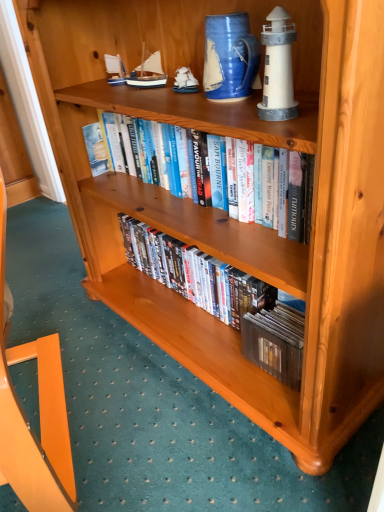
The image size is (384, 512). What do you see at coordinates (230, 57) in the screenshot?
I see `blue ceramic pitcher at upper center` at bounding box center [230, 57].

You are a GUI agent. You are given a task and a screenshot of the screen. Output one action in this format:
    pyautogui.click(x=<x>, y=<y>)
    Task: Click on the white matte lighthouse at upper right, acting as the third toy starting from the left
    
    Given the screenshot: What is the action you would take?
    pyautogui.click(x=278, y=68)

Considering the relative positions of wooden ship at upper center, acting as the 2th toy starting from the back, and blue ceramic pitcher at upper center in the image provided, is wooden ship at upper center, acting as the 2th toy starting from the back, to the left or to the right of blue ceramic pitcher at upper center?

Clearly, wooden ship at upper center, acting as the 2th toy starting from the back, is on the left of blue ceramic pitcher at upper center in the image.

Identify the location of pitcher that appears on the right of wooden ship at upper center, which is the 2th toy from right to left. (230, 57).

Based on the photo, is the depth of wooden ship at upper center, acting as the 2th toy starting from the front, greater than that of blue ceramic pitcher at upper center?

Yes, it is.

From the picture: Is wooden ship at upper center, which is the 2th toy from right to left, facing away from blue ceramic pitcher at upper center?

That's not correct — wooden ship at upper center, which is the 2th toy from right to left, is not looking away from blue ceramic pitcher at upper center.

Which point is more forward, [187,194] or [266,92]?

The point [266,92] is in front.

From the image's perspective, who appears lower, hardcover books at center, placed as the first book when sorted from top to bottom, or white matte lighthouse at upper right, the 1th toy in the right-to-left sequence?

From the image's view, hardcover books at center, placed as the first book when sorted from top to bottom, is below.

Is hardcover books at center, placed as the first book when sorted from top to bottom, with white matte lighthouse at upper right, the 1th toy in the right-to-left sequence?

hardcover books at center, placed as the first book when sorted from top to bottom, and white matte lighthouse at upper right, the 1th toy in the right-to-left sequence, are not in contact.

Considering the positions of point (208, 89) and point (131, 74), is point (208, 89) closer or farther from the camera than point (131, 74)?

Point (208, 89).

Is blue ceramic pitcher at upper center smaller than blue painted wood sailboat at upper center, acting as the 3th toy starting from the front?

Incorrect, blue ceramic pitcher at upper center is not smaller in size than blue painted wood sailboat at upper center, acting as the 3th toy starting from the front.

Is blue ceramic pitcher at upper center positioned with its back to blue painted wood sailboat at upper center, which ranks as the first toy in left-to-right order?

blue ceramic pitcher at upper center does not have its back to blue painted wood sailboat at upper center, which ranks as the first toy in left-to-right order.

In the scene shown: From the image's perspective, which object appears higher, white matte lighthouse at upper right, the 1th toy in the right-to-left sequence, or matte wooden dvds at center, the 1th book positioned from the bottom?

white matte lighthouse at upper right, the 1th toy in the right-to-left sequence, is shown above in the image.

Is white matte lighthouse at upper right, placed as the 3th toy when sorted from back to front, positioned beyond the bounds of matte wooden dvds at center, the 1th book positioned from the bottom?

white matte lighthouse at upper right, placed as the 3th toy when sorted from back to front, is positioned outside matte wooden dvds at center, the 1th book positioned from the bottom.

Starting from the white matte lighthouse at upper right, the 1th toy in the right-to-left sequence, which book is the 2nd one behind? Please provide its 2D coordinates.

[(223, 297)]

Considering the positions of objects white matte lighthouse at upper right, the 1th toy in the right-to-left sequence, and matte wooden dvds at center, which appears as the 2th book when viewed from the top, in the image provided, who is in front, white matte lighthouse at upper right, the 1th toy in the right-to-left sequence, or matte wooden dvds at center, which appears as the 2th book when viewed from the top,?

white matte lighthouse at upper right, the 1th toy in the right-to-left sequence, is more forward.

In the image, is hardcover books at center, placed as the first book when sorted from top to bottom, positioned in front of or behind matte wooden dvds at center, the 1th book positioned from the bottom?

Clearly, hardcover books at center, placed as the first book when sorted from top to bottom, is in front of matte wooden dvds at center, the 1th book positioned from the bottom.

In the scene shown: From a real-world perspective, is hardcover books at center, placed as the first book when sorted from top to bottom, located higher than matte wooden dvds at center, the 1th book positioned from the bottom?

Yes.

Based on the photo, is hardcover books at center, which is the 2th book from bottom to top, far away from matte wooden dvds at center, the 1th book positioned from the bottom?

hardcover books at center, which is the 2th book from bottom to top, is near matte wooden dvds at center, the 1th book positioned from the bottom, not far away.

Does blue ceramic pitcher at upper center come behind matte wooden dvds at center, the 1th book positioned from the bottom?

No, it is in front of matte wooden dvds at center, the 1th book positioned from the bottom.

Between point (226, 90) and point (129, 256), which one is positioned in front?

Positioned in front is point (226, 90).

Which object is positioned more to the right, blue ceramic pitcher at upper center or matte wooden dvds at center, the 1th book positioned from the bottom?

A: matte wooden dvds at center, the 1th book positioned from the bottom.

Is matte wooden dvds at center, which appears as the 2th book when viewed from the top, at the left side of blue painted wood sailboat at upper center, placed as the first toy when sorted from back to front?

In fact, matte wooden dvds at center, which appears as the 2th book when viewed from the top, is to the right of blue painted wood sailboat at upper center, placed as the first toy when sorted from back to front.

From their relative heights in the image, would you say matte wooden dvds at center, the 1th book positioned from the bottom, is taller or shorter than blue painted wood sailboat at upper center, which ranks as the third toy in right-to-left order?

Clearly, matte wooden dvds at center, the 1th book positioned from the bottom, is taller compared to blue painted wood sailboat at upper center, which ranks as the third toy in right-to-left order.

In the image, is matte wooden dvds at center, the 1th book positioned from the bottom, positioned in front of or behind blue painted wood sailboat at upper center, which ranks as the third toy in right-to-left order?

Clearly, matte wooden dvds at center, the 1th book positioned from the bottom, is in front of blue painted wood sailboat at upper center, which ranks as the third toy in right-to-left order.

From the image's perspective, starting from the blue painted wood sailboat at upper center, placed as the first toy when sorted from back to front, which book is the 2nd one below? Please provide its 2D coordinates.

[(223, 297)]

The height and width of the screenshot is (512, 384). There is a blue ceramic pitcher at upper center. What are the coordinates of `the 1st toy above it (from the image's perspective)` in the screenshot? It's located at (185, 81).

Image resolution: width=384 pixels, height=512 pixels. What are the coordinates of `the 2nd book to the left of the white matte lighthouse at upper right, the 1th toy in the right-to-left sequence, counting from the anchor's position` in the screenshot? It's located at (224, 177).

Which object lies nearer to the anchor point white matte lighthouse at upper right, which is counted as the first toy, starting from the front, blue ceramic pitcher at upper center or hardcover books at center, which is the 2th book from bottom to top?

blue ceramic pitcher at upper center lies closer to white matte lighthouse at upper right, which is counted as the first toy, starting from the front, than the other object.

Based on their spatial positions, is white matte lighthouse at upper right, placed as the 3th toy when sorted from back to front, or blue painted wood sailboat at upper center, acting as the 3th toy starting from the front, further from hardcover books at center, which is the 2th book from bottom to top?

white matte lighthouse at upper right, placed as the 3th toy when sorted from back to front, is further to hardcover books at center, which is the 2th book from bottom to top.

Considering their positions, is hardcover books at center, which is the 2th book from bottom to top, positioned closer to wooden ship at upper center, which is the 2th toy from right to left, than white matte lighthouse at upper right, which is counted as the first toy, starting from the front?

The object closer to wooden ship at upper center, which is the 2th toy from right to left, is hardcover books at center, which is the 2th book from bottom to top.

Based on their spatial positions, is white matte lighthouse at upper right, placed as the 3th toy when sorted from back to front, or blue ceramic pitcher at upper center closer to matte wooden dvds at center, the 1th book positioned from the bottom?

blue ceramic pitcher at upper center.

Estimate the real-world distances between objects in this image. Which object is further from matte wooden dvds at center, the 1th book positioned from the bottom, hardcover books at center, placed as the first book when sorted from top to bottom, or blue ceramic pitcher at upper center?

The object further to matte wooden dvds at center, the 1th book positioned from the bottom, is blue ceramic pitcher at upper center.

From the image, which object appears to be farther from hardcover books at center, placed as the first book when sorted from top to bottom, white matte lighthouse at upper right, placed as the 3th toy when sorted from back to front, or blue ceramic pitcher at upper center?

white matte lighthouse at upper right, placed as the 3th toy when sorted from back to front, is positioned further to the anchor hardcover books at center, placed as the first book when sorted from top to bottom.

Estimate the real-world distances between objects in this image. Which object is further from wooden ship at upper center, acting as the 2th toy starting from the front, blue painted wood sailboat at upper center, acting as the 3th toy starting from the front, or matte wooden dvds at center, which appears as the 2th book when viewed from the top?

Based on the image, matte wooden dvds at center, which appears as the 2th book when viewed from the top, appears to be further to wooden ship at upper center, acting as the 2th toy starting from the front.

Looking at the image, which one is located further to blue ceramic pitcher at upper center, white matte lighthouse at upper right, placed as the 3th toy when sorted from back to front, or blue painted wood sailboat at upper center, which ranks as the first toy in left-to-right order?

Among the two, blue painted wood sailboat at upper center, which ranks as the first toy in left-to-right order, is located further to blue ceramic pitcher at upper center.

Identify the location of pitcher located between hardcover books at center, placed as the first book when sorted from top to bottom, and wooden ship at upper center, acting as the 2th toy starting from the front, in the depth direction. Image resolution: width=384 pixels, height=512 pixels. (230, 57).

Locate an element on the screen. Image resolution: width=384 pixels, height=512 pixels. book that lies between blue ceramic pitcher at upper center and matte wooden dvds at center, which appears as the 2th book when viewed from the top, from top to bottom is located at coordinates (224, 177).

This screenshot has width=384, height=512. I want to click on toy positioned between hardcover books at center, which is the 2th book from bottom to top, and blue painted wood sailboat at upper center, placed as the first toy when sorted from back to front, from near to far, so click(x=185, y=81).

This screenshot has width=384, height=512. Identify the location of book between blue painted wood sailboat at upper center, which ranks as the first toy in left-to-right order, and matte wooden dvds at center, the 1th book positioned from the bottom, in the up-down direction. (224, 177).